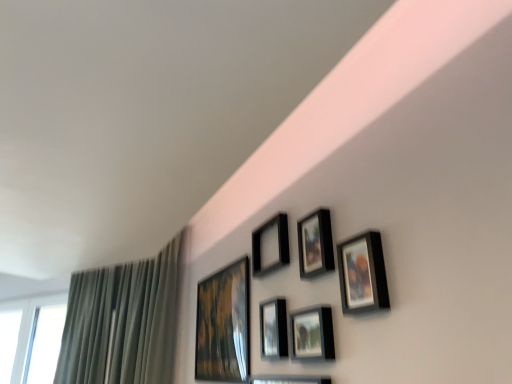
Question: Considering the relative positions of green fabric curtain at left and matte black picture frame at upper center, which ranks as the fifth picture frame in right-to-left order, in the image provided, is green fabric curtain at left behind matte black picture frame at upper center, which ranks as the fifth picture frame in right-to-left order,?

Choices:
 (A) no
 (B) yes

Answer: (B)

Question: From the image's perspective, is green fabric curtain at left below matte black picture frame at upper center, which ranks as the fifth picture frame in right-to-left order?

Choices:
 (A) yes
 (B) no

Answer: (A)

Question: Is green fabric curtain at left positioned beyond the bounds of matte black picture frame at upper center, acting as the second picture frame starting from the left?

Choices:
 (A) yes
 (B) no

Answer: (A)

Question: Could you tell me if green fabric curtain at left is facing matte black picture frame at upper center, which ranks as the fifth picture frame in right-to-left order?

Choices:
 (A) yes
 (B) no

Answer: (B)

Question: Is matte black picture frame at upper center, acting as the second picture frame starting from the left, located within green fabric curtain at left?

Choices:
 (A) yes
 (B) no

Answer: (B)

Question: Is matte black picture frame at center, the fourth picture frame from the right, in front of or behind matte black picture frame at upper right, arranged as the 1th picture frame when viewed from the right, in the image?

Choices:
 (A) behind
 (B) front

Answer: (A)

Question: From a real-world perspective, is matte black picture frame at center, the 3th picture frame viewed from the left, positioned above or below matte black picture frame at upper right, arranged as the 6th picture frame when viewed from the left?

Choices:
 (A) below
 (B) above

Answer: (A)

Question: Based on their sizes in the image, would you say matte black picture frame at center, the 3th picture frame viewed from the left, is bigger or smaller than matte black picture frame at upper right, arranged as the 1th picture frame when viewed from the right?

Choices:
 (A) small
 (B) big

Answer: (B)

Question: Is matte black picture frame at center, the fourth picture frame from the right, inside or outside of matte black picture frame at upper right, arranged as the 1th picture frame when viewed from the right?

Choices:
 (A) inside
 (B) outside

Answer: (B)

Question: Is green fabric curtain at left bigger or smaller than white glass window at lower left?

Choices:
 (A) small
 (B) big

Answer: (B)

Question: Is point (73, 345) closer or farther from the camera than point (14, 309)?

Choices:
 (A) closer
 (B) farther

Answer: (A)

Question: In terms of width, does green fabric curtain at left look wider or thinner when compared to white glass window at lower left?

Choices:
 (A) wide
 (B) thin

Answer: (A)

Question: From the image's perspective, is green fabric curtain at left positioned above or below white glass window at lower left?

Choices:
 (A) below
 (B) above

Answer: (B)

Question: Considering the positions of point (318, 263) and point (262, 314), is point (318, 263) closer or farther from the camera than point (262, 314)?

Choices:
 (A) closer
 (B) farther

Answer: (A)

Question: Would you say matte black picture frame at upper center, arranged as the 2th picture frame when viewed from the right, is inside or outside matte black picture frame at center, the fourth picture frame from the right?

Choices:
 (A) inside
 (B) outside

Answer: (B)